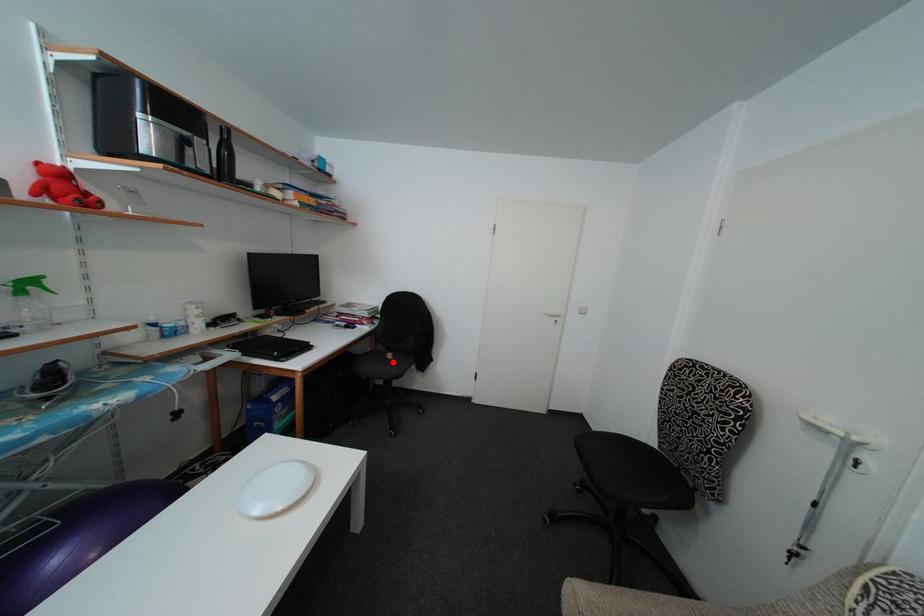
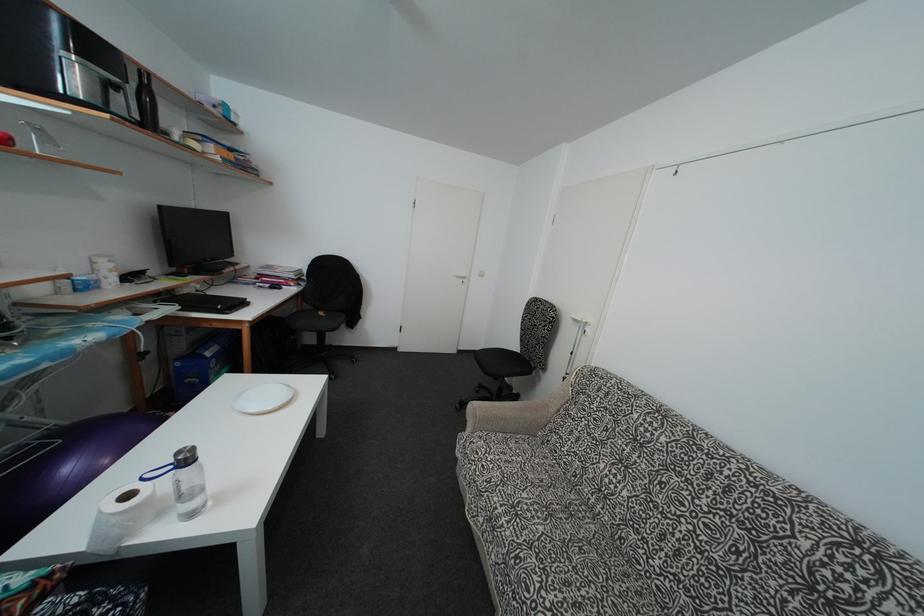
Where in the second image is the point corresponding to the highlighted location from the first image?

(325, 320)